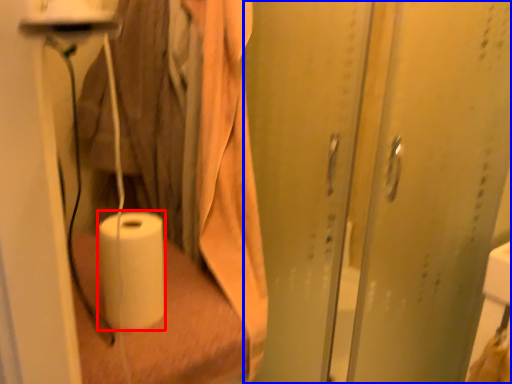
Question: Which object appears farthest to the camera in this image, paper towel (highlighted by a red box) or screen door (highlighted by a blue box)?

Choices:
 (A) paper towel
 (B) screen door

Answer: (A)